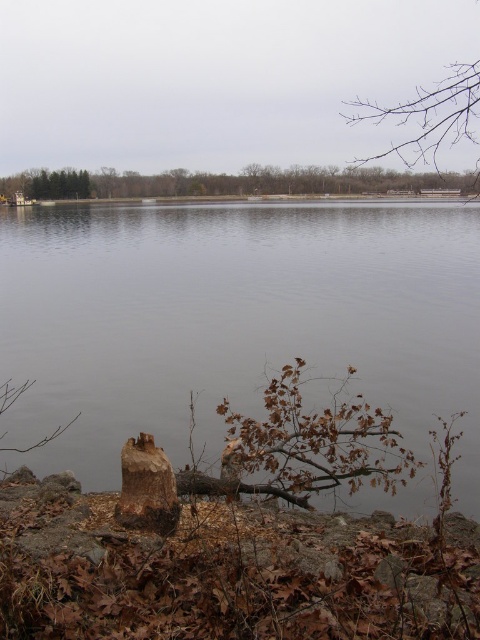
Is point (286, 225) positioned behind point (136, 492)?

Yes, it is behind point (136, 492).

The height and width of the screenshot is (640, 480). What do you see at coordinates (239, 326) in the screenshot? I see `gray water at center` at bounding box center [239, 326].

Find the location of a particular element. The width and height of the screenshot is (480, 640). gray water at center is located at coordinates tap(239, 326).

Find the location of `gray water at center`. gray water at center is located at coordinates (239, 326).

In the scene shown: Between gray water at center and brown rough tree trunk at lower center, which one appears on the left side from the viewer's perspective?

Positioned to the left is brown rough tree trunk at lower center.

Between gray water at center and brown rough tree trunk at lower center, which one is positioned higher?

Positioned higher is gray water at center.

Is point (110, 460) behind point (232, 497)?

Yes.

Identify the location of gray water at center. (239, 326).

Does gray water at center have a lesser width compared to brown wood tree at center?

Yes.

In order to click on gray water at center in this screenshot , I will do `click(239, 326)`.

What do you see at coordinates (239, 326) in the screenshot? I see `gray water at center` at bounding box center [239, 326].

Locate an element on the screen. gray water at center is located at coordinates (239, 326).